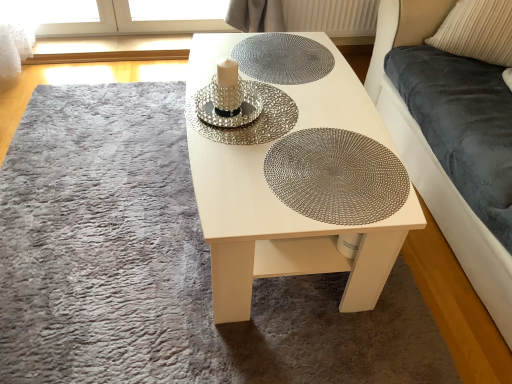
What do you see at coordinates (437, 160) in the screenshot? This screenshot has width=512, height=384. I see `velvet dark blue couch at right` at bounding box center [437, 160].

How much space does metallic woven placemat at center, marked as the 1th glass plate in a bottom-to-top arrangement, occupy horizontally?

The width of metallic woven placemat at center, marked as the 1th glass plate in a bottom-to-top arrangement, is 15.44 inches.

This screenshot has height=384, width=512. Identify the location of velvet dark blue couch at right. [437, 160].

What's the angular difference between metallic woven placemat at center, marked as the 1th glass plate in a bottom-to-top arrangement, and beige corduroy pillow at upper right's facing directions?

They differ by 52.8 degrees in their facing directions.

From the image's perspective, which object appears higher, metallic woven placemat at center, placed as the third glass plate when sorted from top to bottom, or beige corduroy pillow at upper right?

beige corduroy pillow at upper right appears higher in the image.

Is metallic woven placemat at center, marked as the 1th glass plate in a bottom-to-top arrangement, oriented away from beige corduroy pillow at upper right?

No, metallic woven placemat at center, marked as the 1th glass plate in a bottom-to-top arrangement,'s orientation is not away from beige corduroy pillow at upper right.

From the picture: Are metallic woven placemat at center, marked as the 1th glass plate in a bottom-to-top arrangement, and beige corduroy pillow at upper right making contact?

metallic woven placemat at center, marked as the 1th glass plate in a bottom-to-top arrangement, and beige corduroy pillow at upper right are clearly separated.

From a real-world perspective, is velvet dark blue couch at right on top of metallic textured glass plate at center, which ranks as the 3th glass plate in bottom-to-top order?

Incorrect, from a real-world perspective, velvet dark blue couch at right is lower than metallic textured glass plate at center, which ranks as the 3th glass plate in bottom-to-top order.

Is point (483, 290) farther from camera compared to point (275, 45)?

That is False.

How far apart are velvet dark blue couch at right and metallic textured glass plate at center, which ranks as the 1th glass plate in top-to-bottom order?

They are 24.32 inches apart.

Is velvet dark blue couch at right turned away from metallic textured glass plate at center, which ranks as the 1th glass plate in top-to-bottom order?

No.

From a real-world perspective, is silver metallic plate at center, the second glass plate from the top, beneath white textured mat at center?

Actually, silver metallic plate at center, the second glass plate from the top, is physically above white textured mat at center in the real world.

In terms of width, does silver metallic plate at center, arranged as the second glass plate when ordered from the bottom, look wider or thinner when compared to white textured mat at center?

silver metallic plate at center, arranged as the second glass plate when ordered from the bottom, is thinner than white textured mat at center.

Which object is further away from the camera taking this photo, silver metallic plate at center, arranged as the second glass plate when ordered from the bottom, or white textured mat at center?

Positioned behind is silver metallic plate at center, arranged as the second glass plate when ordered from the bottom.

Considering the relative positions of beige corduroy pillow at upper right and metallic textured glass plate at center, which ranks as the 3th glass plate in bottom-to-top order, in the image provided, is beige corduroy pillow at upper right to the right of metallic textured glass plate at center, which ranks as the 3th glass plate in bottom-to-top order, from the viewer's perspective?

Yes, beige corduroy pillow at upper right is to the right of metallic textured glass plate at center, which ranks as the 3th glass plate in bottom-to-top order.

From a real-world perspective, which object stands above the other?

beige corduroy pillow at upper right.

Based on their sizes in the image, would you say beige corduroy pillow at upper right is bigger or smaller than metallic textured glass plate at center, which ranks as the 1th glass plate in top-to-bottom order?

In the image, beige corduroy pillow at upper right appears to be larger than metallic textured glass plate at center, which ranks as the 1th glass plate in top-to-bottom order.

What's the angular difference between beige corduroy pillow at upper right and metallic textured glass plate at center, which ranks as the 3th glass plate in bottom-to-top order,'s facing directions?

The angle between the facing direction of beige corduroy pillow at upper right and the facing direction of metallic textured glass plate at center, which ranks as the 3th glass plate in bottom-to-top order, is 52.8 degrees.

From a real-world perspective, is white textured mat at center over silver metallic plate at center, the second glass plate from the top?

No, from a real-world perspective, white textured mat at center is not above silver metallic plate at center, the second glass plate from the top.

At what (x,y) coordinates should I click in order to perform the action: click on mat on the left of the silver metallic plate at center, the second glass plate from the top. Please return your answer as a coordinate pair (x, y). This screenshot has height=384, width=512. Looking at the image, I should click on (163, 266).

From the picture: From their relative heights in the image, would you say white textured mat at center is taller or shorter than silver metallic plate at center, the second glass plate from the top?

Considering their sizes, white textured mat at center has more height than silver metallic plate at center, the second glass plate from the top.

Is white wood table at center aimed at metallic woven placemat at center, placed as the third glass plate when sorted from top to bottom?

No, white wood table at center is not facing towards metallic woven placemat at center, placed as the third glass plate when sorted from top to bottom.

Who is shorter, white wood table at center or metallic woven placemat at center, placed as the third glass plate when sorted from top to bottom?

metallic woven placemat at center, placed as the third glass plate when sorted from top to bottom, is shorter.

In terms of width, does white wood table at center look wider or thinner when compared to metallic woven placemat at center, marked as the 1th glass plate in a bottom-to-top arrangement?

Clearly, white wood table at center has more width compared to metallic woven placemat at center, marked as the 1th glass plate in a bottom-to-top arrangement.

Who is smaller, metallic textured glass plate at center, which ranks as the 3th glass plate in bottom-to-top order, or velvet dark blue couch at right?

metallic textured glass plate at center, which ranks as the 3th glass plate in bottom-to-top order, is smaller.

From a real-world perspective, is metallic textured glass plate at center, which ranks as the 1th glass plate in top-to-bottom order, located higher than velvet dark blue couch at right?

Yes, from a real-world perspective, metallic textured glass plate at center, which ranks as the 1th glass plate in top-to-bottom order, is over velvet dark blue couch at right

Find the location of a particular element. Image resolution: width=512 pixels, height=384 pixels. pillow behind the metallic woven placemat at center, marked as the 1th glass plate in a bottom-to-top arrangement is located at coordinates (477, 31).

This screenshot has width=512, height=384. In the image, there is a metallic textured glass plate at center, which ranks as the 1th glass plate in top-to-bottom order. In order to click on couch below it (from a real-world perspective) in this screenshot , I will do `click(437, 160)`.

Considering their positions, is white textured mat at center positioned further to metallic textured glass plate at center, which ranks as the 1th glass plate in top-to-bottom order, than beige corduroy pillow at upper right?

white textured mat at center is positioned further to the anchor metallic textured glass plate at center, which ranks as the 1th glass plate in top-to-bottom order.

Based on their spatial positions, is metallic textured glass plate at center, which ranks as the 3th glass plate in bottom-to-top order, or white textured radiator at upper center closer to silver metallic plate at center, the second glass plate from the top?

metallic textured glass plate at center, which ranks as the 3th glass plate in bottom-to-top order, is closer to silver metallic plate at center, the second glass plate from the top.

From the image, which object appears to be farther from beige corduroy pillow at upper right, metallic woven placemat at center, placed as the third glass plate when sorted from top to bottom, or white wood table at center?

The object further to beige corduroy pillow at upper right is metallic woven placemat at center, placed as the third glass plate when sorted from top to bottom.

Looking at the image, which one is located closer to metallic textured glass plate at center, which ranks as the 1th glass plate in top-to-bottom order, silver metallic plate at center, arranged as the second glass plate when ordered from the bottom, or white wood table at center?

Based on the image, silver metallic plate at center, arranged as the second glass plate when ordered from the bottom, appears to be nearer to metallic textured glass plate at center, which ranks as the 1th glass plate in top-to-bottom order.

Looking at the image, which one is located closer to metallic textured glass plate at center, which ranks as the 3th glass plate in bottom-to-top order, beige corduroy pillow at upper right or silver metallic plate at center, the second glass plate from the top?

The object closer to metallic textured glass plate at center, which ranks as the 3th glass plate in bottom-to-top order, is silver metallic plate at center, the second glass plate from the top.

When comparing their distances from white wood table at center, does velvet dark blue couch at right or silver metallic plate at center, the second glass plate from the top, seem further?

Among the two, velvet dark blue couch at right is located further to white wood table at center.

Considering their positions, is white textured mat at center positioned closer to white wood table at center than white textured radiator at upper center?

white textured mat at center lies closer to white wood table at center than the other object.

From the image, which object appears to be nearer to metallic textured glass plate at center, which ranks as the 3th glass plate in bottom-to-top order, white wood table at center or metallic woven placemat at center, marked as the 1th glass plate in a bottom-to-top arrangement?

white wood table at center.

This screenshot has height=384, width=512. What are the coordinates of `table between silver metallic plate at center, arranged as the second glass plate when ordered from the bottom, and beige corduroy pillow at upper right, in the horizontal direction` in the screenshot? It's located at (280, 233).

This screenshot has height=384, width=512. What are the coordinates of `pillow between silver metallic plate at center, the second glass plate from the top, and velvet dark blue couch at right from left to right` in the screenshot? It's located at (477, 31).

You are a GUI agent. You are given a task and a screenshot of the screen. Output one action in this format:
    pyautogui.click(x=<x>, y=<y>)
    Task: Click on the table between white textured mat at center and velvet dark blue couch at right from left to right
    The height and width of the screenshot is (384, 512).
    Given the screenshot: What is the action you would take?
    pyautogui.click(x=280, y=233)

Locate an element on the screen. Image resolution: width=512 pixels, height=384 pixels. pillow positioned between white wood table at center and white textured radiator at upper center from near to far is located at coordinates (477, 31).